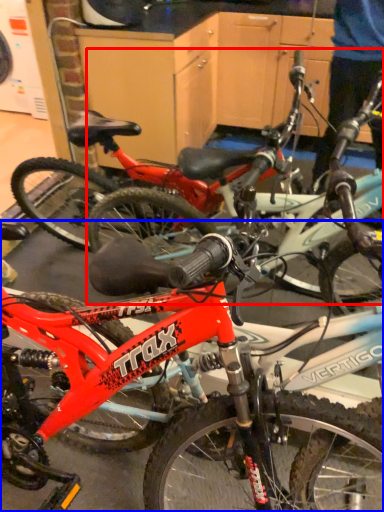
Question: Which point is further to the camera, bicycle (highlighted by a red box) or bicycle (highlighted by a blue box)?

Choices:
 (A) bicycle
 (B) bicycle

Answer: (A)